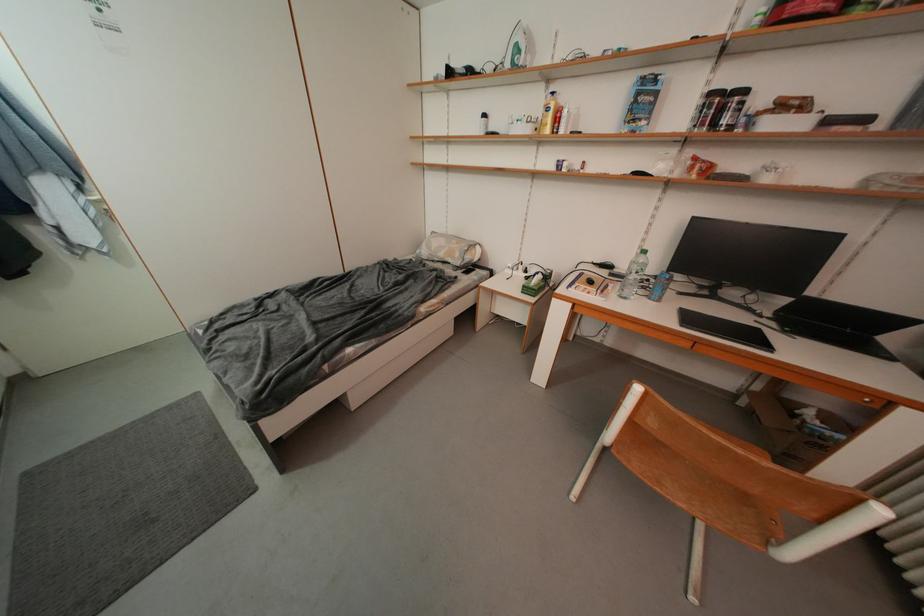
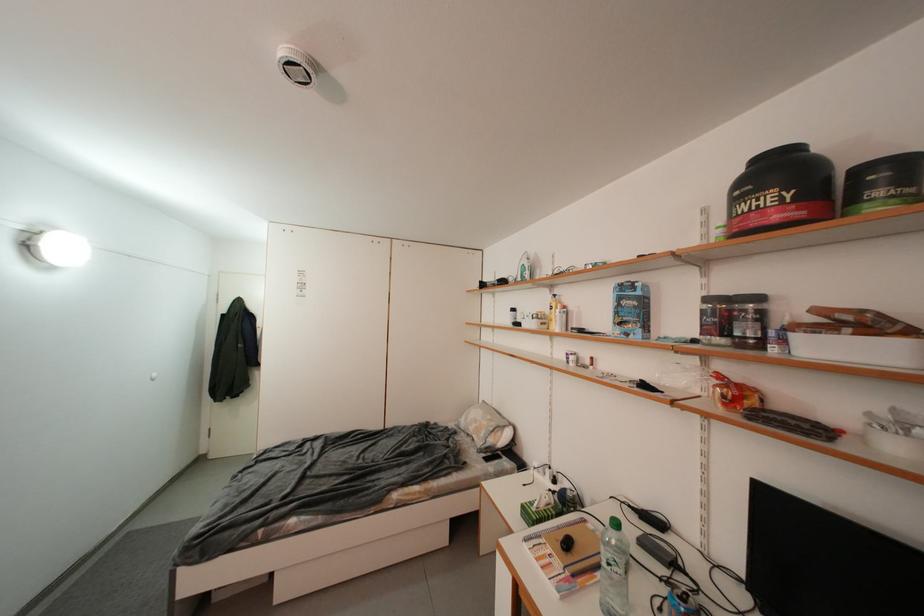
In the second image, find the point that corresponds to pixel 706 177 in the first image.

(733, 408)